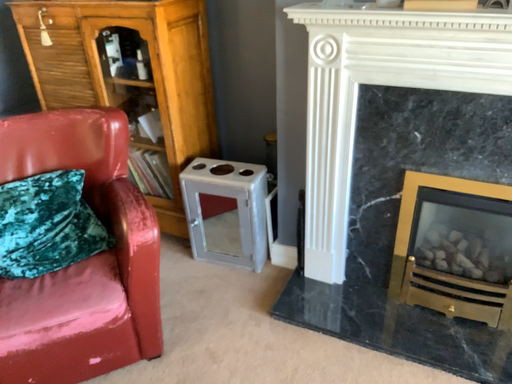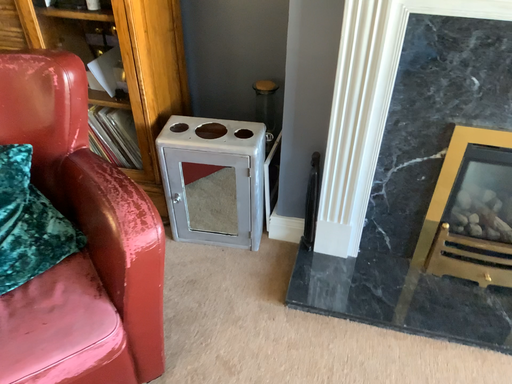
Question: Which way did the camera rotate in the video?

Choices:
 (A) rotated left
 (B) rotated right

Answer: (B)